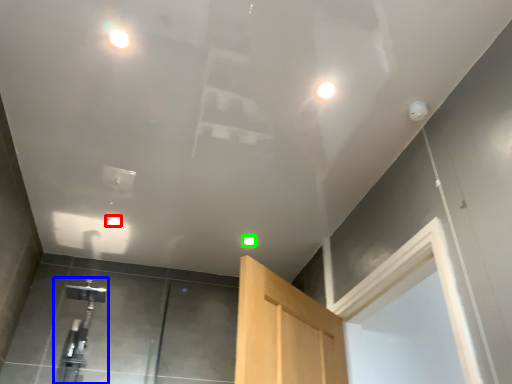
Question: Estimate the real-world distances between objects in this image. Which object is farther from droplight (highlighted by a red box), faucet (highlighted by a blue box) or droplight (highlighted by a green box)?

Choices:
 (A) faucet
 (B) droplight

Answer: (B)